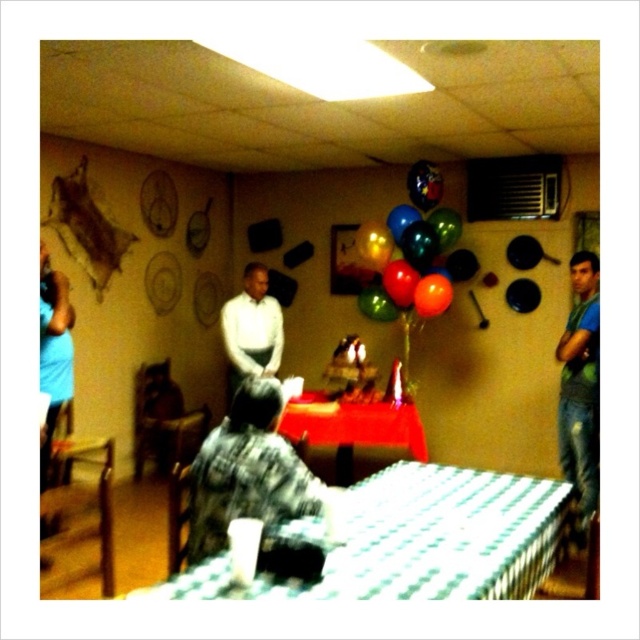
You are at a birthday party and want to take a photo of the multicolored balloons at center. If your camera has a maximum focus distance of 4 meters, will it be able to focus on the balloons?

The multicolored balloons at center is 4.37 meters away from camera. Since the distance exceeds the camera maximum focus distance of 4 meters, the camera cannot focus on the balloons.